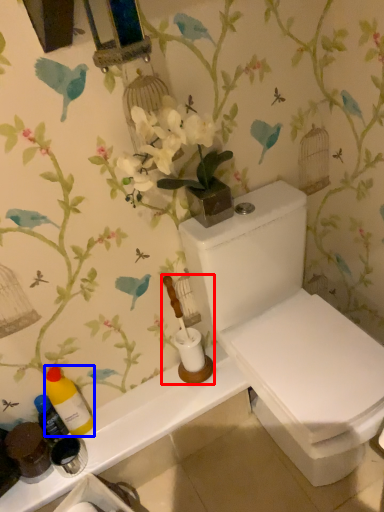
Question: Among these objects, which one is nearest to the camera, toiletries (highlighted by a red box) or bottle (highlighted by a blue box)?

Choices:
 (A) toiletries
 (B) bottle

Answer: (A)